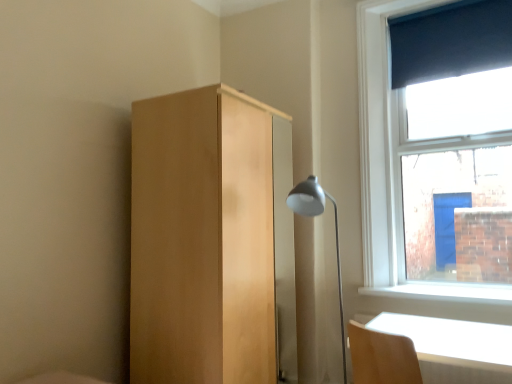
Question: Looking at their shapes, would you say light wood table at lower right is wider or thinner than light wood dresser at center?

Choices:
 (A) wide
 (B) thin

Answer: (B)

Question: Would you say light wood table at lower right is inside or outside light wood dresser at center?

Choices:
 (A) inside
 (B) outside

Answer: (B)

Question: Which of these objects is positioned closest to the light wood dresser at center?

Choices:
 (A) dark blue fabric at upper right
 (B) matte silver lamp at center-right
 (C) light wood table at lower right

Answer: (B)

Question: Estimate the real-world distances between objects in this image. Which object is closer to the light wood dresser at center?

Choices:
 (A) matte silver lamp at center-right
 (B) light wood table at lower right
 (C) dark blue fabric at upper right

Answer: (A)